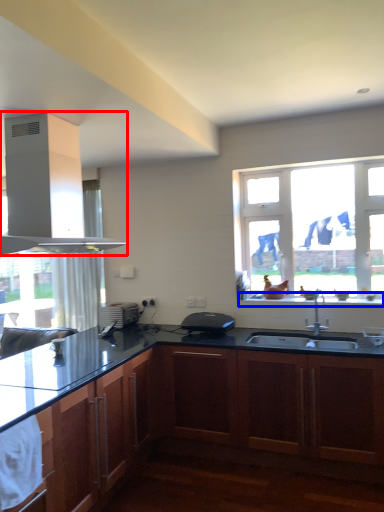
Question: Which of the following is the closest to the observer, gas stove (highlighted by a red box) or window sill (highlighted by a blue box)?

Choices:
 (A) gas stove
 (B) window sill

Answer: (A)